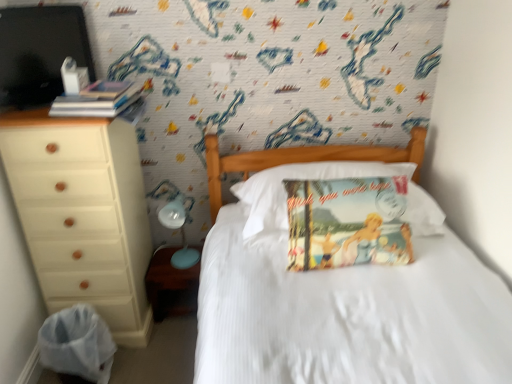
Question: Is light blue plastic table lamp at lower left oriented towards beige wood chest of drawers at left?

Choices:
 (A) yes
 (B) no

Answer: (B)

Question: Is light blue plastic table lamp at lower left positioned before beige wood chest of drawers at left?

Choices:
 (A) yes
 (B) no

Answer: (B)

Question: From a real-world perspective, is light blue plastic table lamp at lower left over beige wood chest of drawers at left?

Choices:
 (A) no
 (B) yes

Answer: (A)

Question: Is light blue plastic table lamp at lower left far away from beige wood chest of drawers at left?

Choices:
 (A) no
 (B) yes

Answer: (A)

Question: From the image's perspective, is light blue plastic table lamp at lower left located beneath beige wood chest of drawers at left?

Choices:
 (A) no
 (B) yes

Answer: (B)

Question: In terms of width, does matte brown wood at lower left look wider or thinner when compared to hardcover books at left, which is the 1th book in top-to-bottom order?

Choices:
 (A) thin
 (B) wide

Answer: (A)

Question: In the image, is matte brown wood at lower left on the left side or the right side of hardcover books at left, which is the 1th book in top-to-bottom order?

Choices:
 (A) left
 (B) right

Answer: (B)

Question: Do you think matte brown wood at lower left is within hardcover books at left, positioned as the 2th book in bottom-to-top order, or outside of it?

Choices:
 (A) inside
 (B) outside

Answer: (B)

Question: Considering the positions of matte brown wood at lower left and hardcover books at left, the 1th book in the left-to-right sequence, in the image, is matte brown wood at lower left bigger or smaller than hardcover books at left, the 1th book in the left-to-right sequence,?

Choices:
 (A) small
 (B) big

Answer: (B)

Question: Is vintage paper pillow at center, which is the second book from left to right, in front of or behind hardcover books at left, the 1th book in the left-to-right sequence, in the image?

Choices:
 (A) front
 (B) behind

Answer: (A)

Question: Considering the positions of point (335, 256) and point (132, 99), is point (335, 256) closer or farther from the camera than point (132, 99)?

Choices:
 (A) closer
 (B) farther

Answer: (A)

Question: Considering the relative positions of vintage paper pillow at center, the 2th book in the top-to-bottom sequence, and hardcover books at left, the second book when ordered from right to left, in the image provided, is vintage paper pillow at center, the 2th book in the top-to-bottom sequence, to the left or to the right of hardcover books at left, the second book when ordered from right to left,?

Choices:
 (A) right
 (B) left

Answer: (A)

Question: In terms of width, does vintage paper pillow at center, the 1th book when ordered from bottom to top, look wider or thinner when compared to hardcover books at left, the second book when ordered from right to left?

Choices:
 (A) thin
 (B) wide

Answer: (B)

Question: Considering the positions of vintage paper pillow at center and matte brown wood at lower left in the image, is vintage paper pillow at center wider or thinner than matte brown wood at lower left?

Choices:
 (A) wide
 (B) thin

Answer: (A)

Question: Based on their positions, is vintage paper pillow at center located to the left or right of matte brown wood at lower left?

Choices:
 (A) right
 (B) left

Answer: (A)